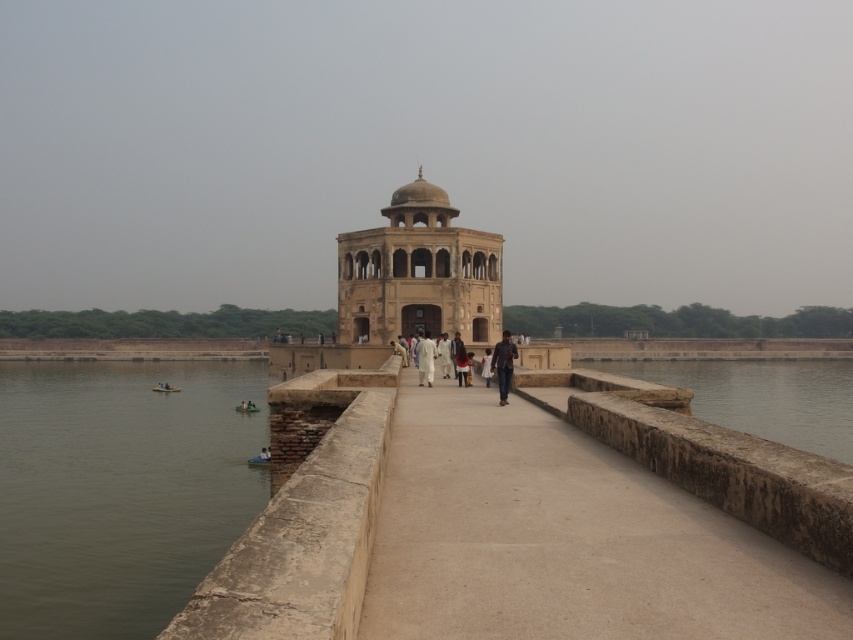
Can you confirm if smooth stone pathway at center is thinner than white cotton person at center?

In fact, smooth stone pathway at center might be wider than white cotton person at center.

Does smooth stone pathway at center appear on the left side of white cotton person at center?

No, smooth stone pathway at center is not to the left of white cotton person at center.

Which is in front, point (613, 461) or point (422, 346)?

Point (613, 461) is in front.

Where is `smooth stone pathway at center`? The image size is (853, 640). smooth stone pathway at center is located at coordinates (564, 540).

Does brown stone water at lower center appear under dark blue jeans at center?

Correct, brown stone water at lower center is located below dark blue jeans at center.

Which is above, brown stone water at lower center or dark blue jeans at center?

Positioned higher is dark blue jeans at center.

This screenshot has height=640, width=853. Describe the element at coordinates (761, 396) in the screenshot. I see `brown stone water at lower center` at that location.

At what (x,y) coordinates should I click in order to perform the action: click on brown stone water at lower center. Please return your answer as a coordinate pair (x, y). This screenshot has height=640, width=853. Looking at the image, I should click on (761, 396).

Does point (386, 241) lie behind point (418, 362)?

Yes, point (386, 241) is farther from viewer.

Is beige stone palace at center positioned in front of white cotton person at center?

No.

The image size is (853, 640). What do you see at coordinates (418, 273) in the screenshot? I see `beige stone palace at center` at bounding box center [418, 273].

Identify the location of beige stone palace at center. (418, 273).